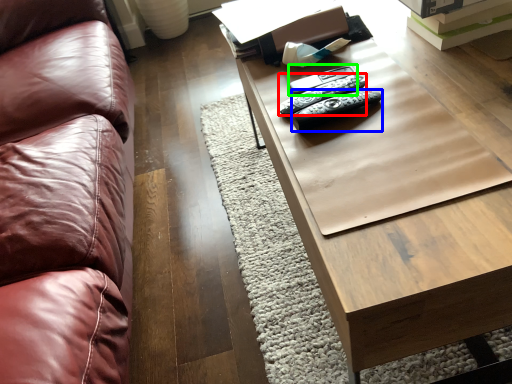
Question: Considering the real-world distances, which object is farthest from remote (highlighted by a red box)? remote (highlighted by a blue box) or remote (highlighted by a green box)?

Choices:
 (A) remote
 (B) remote

Answer: (B)